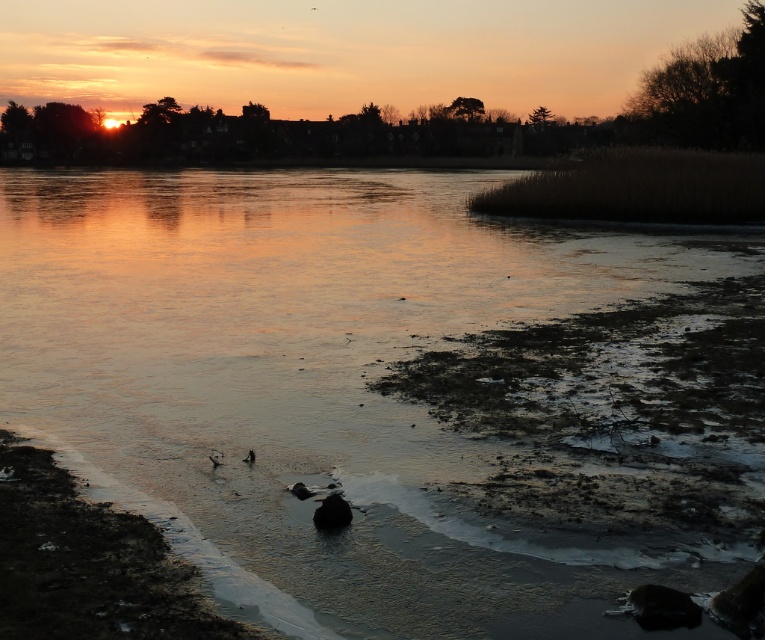
Between point (314, 541) and point (251, 451), which one is positioned in front?

Point (314, 541) is in front.

Describe the element at coordinates (321, 372) in the screenshot. I see `translucent ice at center` at that location.

Locate an element on the screen. This screenshot has height=640, width=765. translucent ice at center is located at coordinates (321, 372).

Which is in front, point (60, 369) or point (350, 518)?

Point (350, 518) is more forward.

Does translucent ice at center have a lesser height compared to shiny black rock at center?

No.

Image resolution: width=765 pixels, height=640 pixels. Find the location of `translucent ice at center`. translucent ice at center is located at coordinates (321, 372).

Measure the distance between brown fuzzy bird at lower center and brown fuzzy duck at lower center.

The distance of brown fuzzy bird at lower center from brown fuzzy duck at lower center is 7.81 inches.

Which is in front, point (252, 461) or point (213, 461)?

Positioned in front is point (213, 461).

Locate an element on the screen. brown fuzzy bird at lower center is located at coordinates pyautogui.click(x=249, y=456).